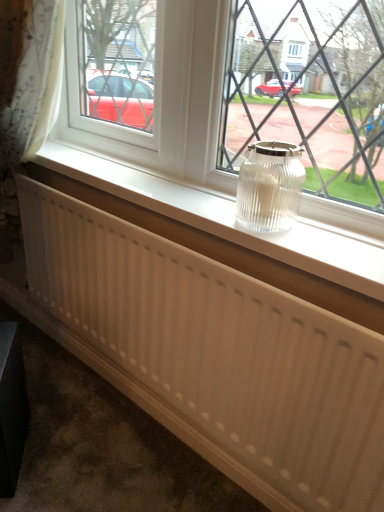
Question: Is clear glass jar at center wider or thinner than clear glass jar at center?

Choices:
 (A) wide
 (B) thin

Answer: (A)

Question: Is point (289, 204) closer or farther from the camera than point (175, 57)?

Choices:
 (A) closer
 (B) farther

Answer: (A)

Question: Estimate the real-world distances between objects in this image. Which object is closer to the white plastic radiator at center?

Choices:
 (A) clear glass jar at center
 (B) clear glass jar at center
 (C) white ribbed radiator at center

Answer: (B)

Question: Which of these objects is positioned farthest from the white ribbed radiator at center?

Choices:
 (A) clear glass jar at center
 (B) white plastic radiator at center
 (C) clear glass jar at center

Answer: (A)